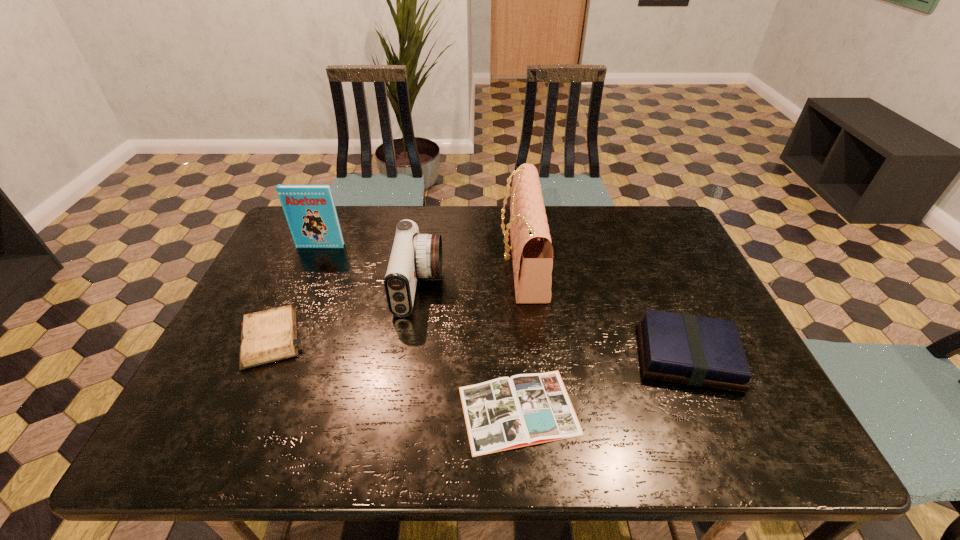
Find the location of a particular element. Image resolution: width=960 pixels, height=540 pixels. handbag is located at coordinates point(532,252).

Find the location of a particular element. the leftmost book is located at coordinates (310, 211).

Where is `the tallest book`? This screenshot has width=960, height=540. the tallest book is located at coordinates (310, 211).

This screenshot has height=540, width=960. In order to click on the third object from left to right in this screenshot , I will do `click(413, 255)`.

This screenshot has height=540, width=960. I want to click on the fourth shortest object, so click(x=413, y=255).

The image size is (960, 540). I want to click on the third shortest object, so click(699, 351).

This screenshot has width=960, height=540. I want to click on the rightmost object, so click(699, 351).

The height and width of the screenshot is (540, 960). Identify the location of diary. (268, 336).

The height and width of the screenshot is (540, 960). Identify the location of the shortest object. (505, 413).

What are the coordinates of `the shortest book` in the screenshot? It's located at click(x=505, y=413).